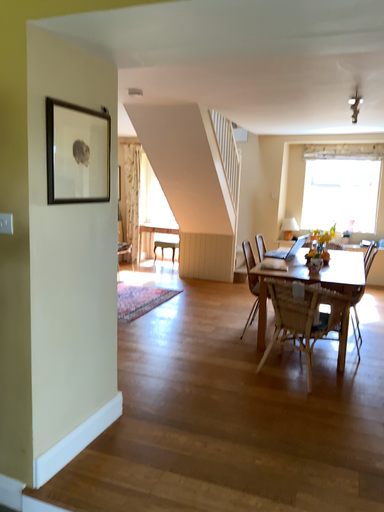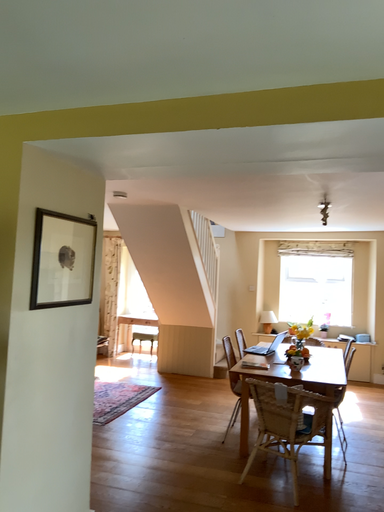
Question: How did the camera likely rotate when shooting the video?

Choices:
 (A) rotated upward
 (B) rotated downward

Answer: (A)